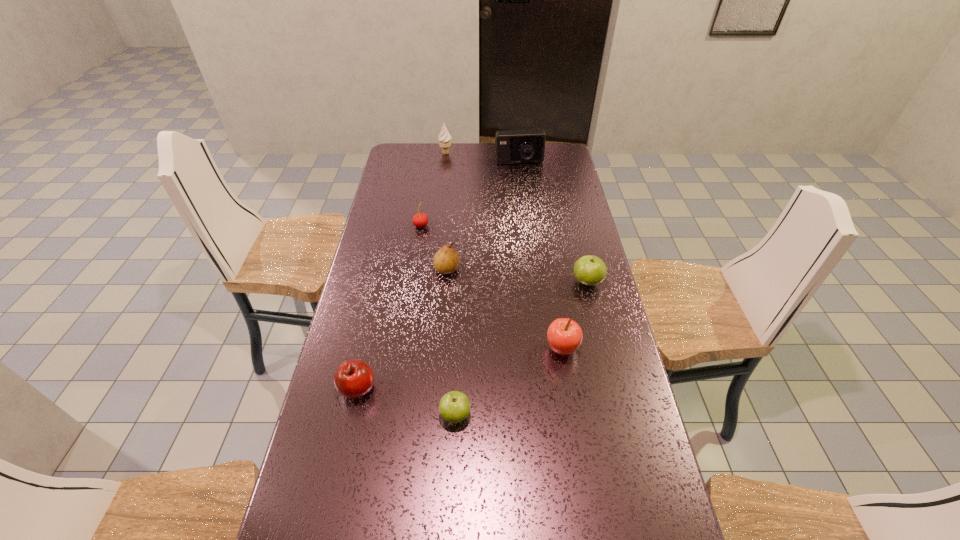
Image resolution: width=960 pixels, height=540 pixels. Identify the location of blank area in the image that satisfies the following two spatial constraints: 1. on the front-facing side of the pear; 2. on the left side of the icecream. (433, 269).

You are a GUI agent. You are given a task and a screenshot of the screen. Output one action in this format:
    pyautogui.click(x=<x>, y=<y>)
    Task: Click on the free location that satisfies the following two spatial constraints: 1. on the front-facing side of the rightmost apple; 2. on the right side of the farthest object
    
    Given the screenshot: What is the action you would take?
    pyautogui.click(x=432, y=282)

Where is `blank area in the image that satisfies the following two spatial constraints: 1. on the front-facing side of the right green apple; 2. on the right side of the farthest object`? blank area in the image that satisfies the following two spatial constraints: 1. on the front-facing side of the right green apple; 2. on the right side of the farthest object is located at coordinates (x=432, y=282).

Find the location of a particular element. free location that satisfies the following two spatial constraints: 1. on the front-facing side of the icecream; 2. on the right side of the second apple from right to left is located at coordinates (424, 349).